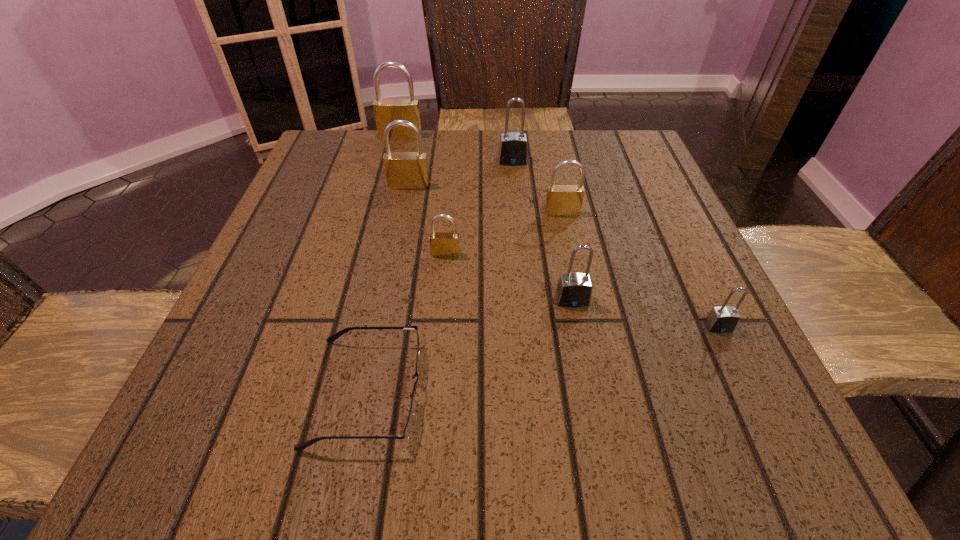
The width and height of the screenshot is (960, 540). What are the coordinates of `vacant area between the biggest brass padlock and the black spectacles` in the screenshot? It's located at (384, 264).

Identify the location of vacant area that lies between the third nearest object and the third nearest brass padlock. (491, 243).

The width and height of the screenshot is (960, 540). In order to click on free space between the second brass padlock from right to left and the farthest padlock in this screenshot , I will do `click(423, 195)`.

At what (x,y) coordinates should I click in order to perform the action: click on vacant space that is in between the sixth farthest padlock and the nearest gray padlock. Please return your answer as a coordinate pair (x, y). This screenshot has height=540, width=960. Looking at the image, I should click on (645, 313).

I want to click on object that can be found as the second closest to the tallest padlock, so point(513,149).

Identify which object is the nearest to the second smallest gray padlock. Please provide its 2D coordinates. Your answer should be formatted as a tuple, i.e. [(x, y)], where the tuple contains the x and y coordinates of a point satisfying the conditions above.

[(723, 319)]

Point out which padlock is positioned as the second nearest to the third nearest brass padlock. Please provide its 2D coordinates. Your answer should be formatted as a tuple, i.e. [(x, y)], where the tuple contains the x and y coordinates of a point satisfying the conditions above.

[(386, 111)]

Select which padlock is the second closest to the third farthest object. Please provide its 2D coordinates. Your answer should be formatted as a tuple, i.e. [(x, y)], where the tuple contains the x and y coordinates of a point satisfying the conditions above.

[(386, 111)]

In order to click on brass padlock identified as the second closest to the sixth nearest padlock in this screenshot , I will do `click(404, 170)`.

Locate an element on the screen. The width and height of the screenshot is (960, 540). brass padlock that is the second nearest to the farthest brass padlock is located at coordinates (561, 200).